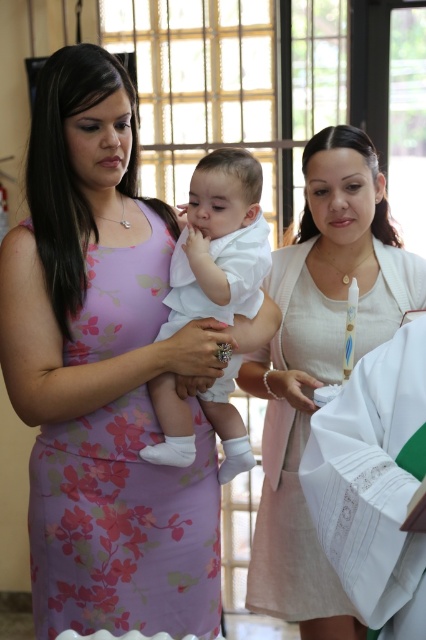
You are a photographer at the baptismal ceremony. You need to position yourself so that the white textured dress at center and the white cotton baby at center are both in frame. Based on their positions, which object should be closer to the left side of your camera view?

The white cotton baby at center is closer to the left side of the camera view because the white textured dress at center is positioned to its right.

You are a photographer at the baptismal ceremony. You need to ensure both the white textured dress at center and the white cotton baby at center are clearly visible in the photo. Given their heights, which one might you need to adjust the camera angle for to capture both properly?

The white textured dress at center is taller than the white cotton baby at center. To capture both clearly, you might need to lower the camera angle slightly to ensure the baby is visible while still framing the dress appropriately.

You are a photographer trying to capture a closeup shot of the floral printed dress at center and the white cotton baby at center. The camera you are using has a maximum focus range of 20 centimeters. Will you be able to focus on both subjects simultaneously?

The floral printed dress at center and white cotton baby at center are 20.58 centimeters apart from each other. Since the distance between them exceeds the camera maximum focus range of 20 centimeters, the photographer cannot focus on both subjects simultaneously.